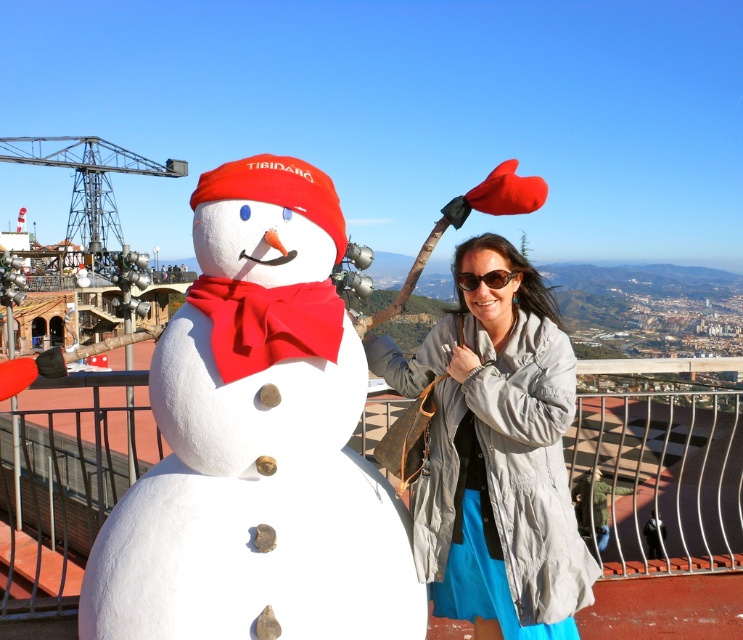
Question: Which point is closer to the camera?

Choices:
 (A) sunglasses at center
 (B) matte gray jacket at center
 (C) white matte snowman at center

Answer: (C)

Question: Is matte gray jacket at center positioned at the back of sunglasses at center?

Choices:
 (A) no
 (B) yes

Answer: (A)

Question: Which of the following is the closest to the observer?

Choices:
 (A) white matte snowman at center
 (B) sunglasses at center

Answer: (A)

Question: Does white matte snowman at center appear on the left side of sunglasses at center?

Choices:
 (A) no
 (B) yes

Answer: (B)

Question: Estimate the real-world distances between objects in this image. Which object is farther from the sunglasses at center?

Choices:
 (A) white matte snowman at center
 (B) matte gray jacket at center

Answer: (A)

Question: Does white matte snowman at center have a larger size compared to sunglasses at center?

Choices:
 (A) no
 (B) yes

Answer: (B)